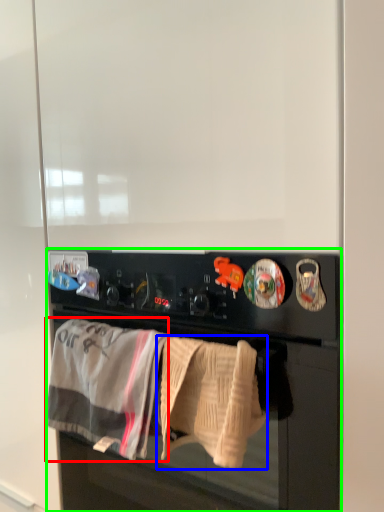
Question: Which is farther away from bath towel (highlighted by a red box)? bath towel (highlighted by a blue box) or home appliance (highlighted by a green box)?

Choices:
 (A) bath towel
 (B) home appliance

Answer: (B)